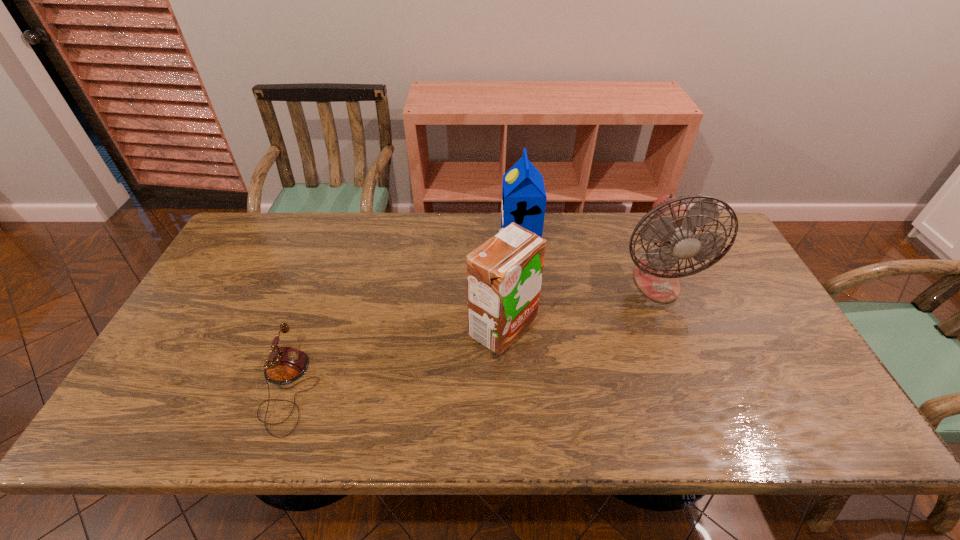
Find the location of a particular element. fan is located at coordinates (674, 227).

The width and height of the screenshot is (960, 540). What are the coordinates of `the farthest object` in the screenshot? It's located at (524, 198).

Find the location of a particular element. the nearer carton is located at coordinates (504, 275).

I want to click on telephone, so click(x=287, y=364).

Locate an element on the screen. the shortest object is located at coordinates (287, 364).

In order to click on free space located 0.290m in front of the rightmost object to direct airflow in this screenshot , I will do `click(704, 398)`.

Identify the location of vacant space located 0.350m with the cap open on the farthest object. (394, 241).

Where is `vacant space located with the cap open on the farthest object`? The width and height of the screenshot is (960, 540). vacant space located with the cap open on the farthest object is located at coordinates (424, 241).

Locate an element on the screen. vacant space located with the cap open on the farthest object is located at coordinates pyautogui.click(x=461, y=241).

Image resolution: width=960 pixels, height=540 pixels. I want to click on free space located 0.360m on the straw side of the nearer carton, so click(x=333, y=328).